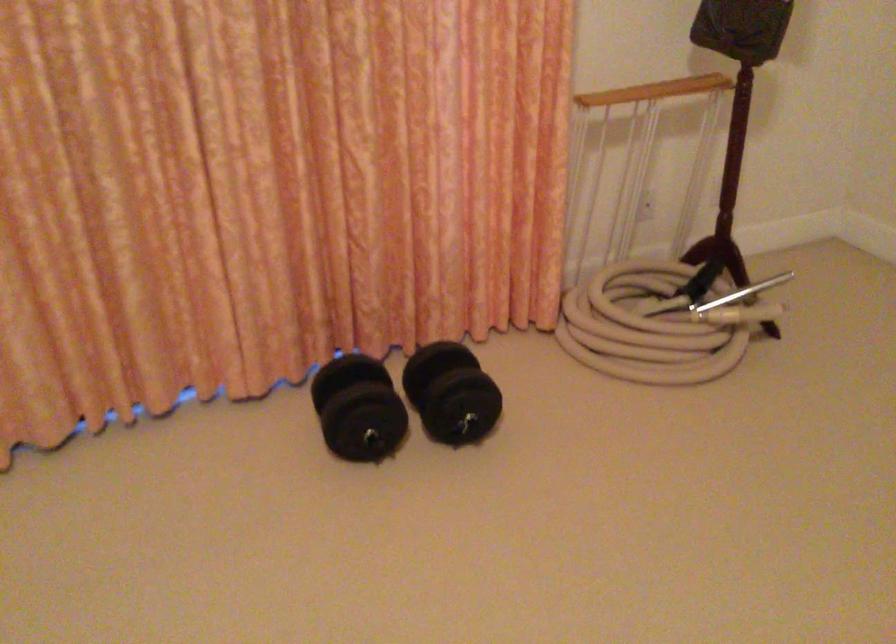
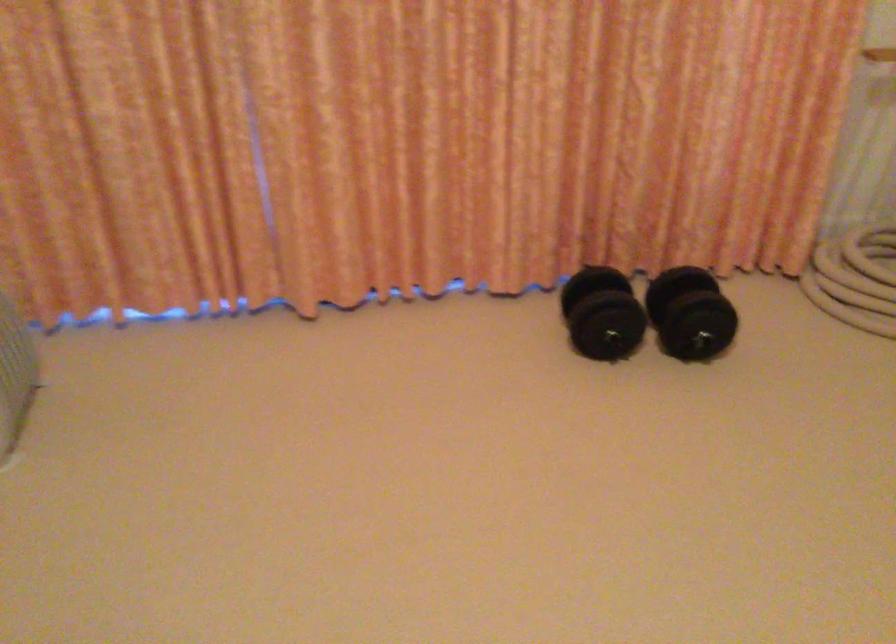
The point at (364, 424) is marked in the first image. Where is the corresponding point in the second image?

(606, 326)